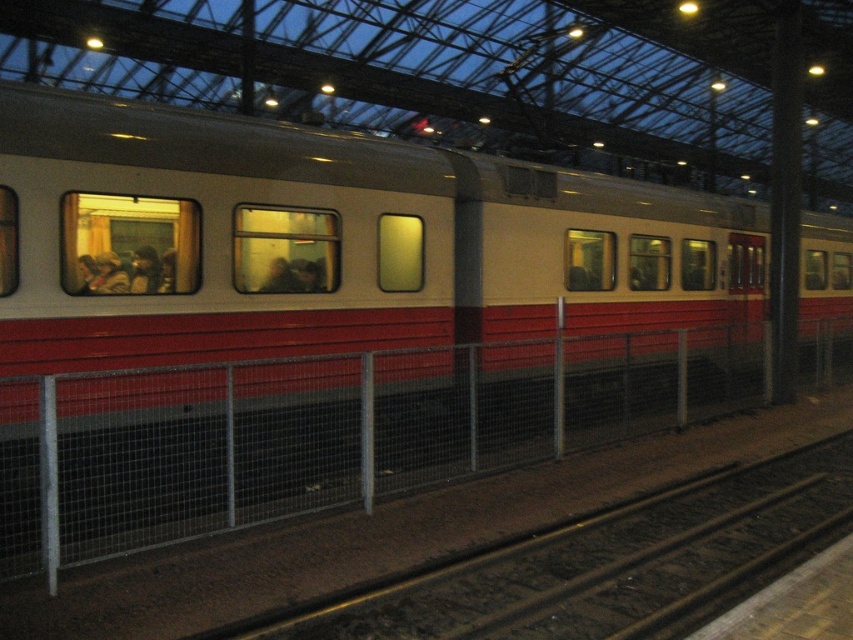
Question: Which point is closer to the camera?

Choices:
 (A) (288, 260)
 (B) (108, 269)
 (C) (148, 284)

Answer: (B)

Question: Which object is closer to the camera taking this photo?

Choices:
 (A) smooth glass window at center
 (B) smooth metal train track at lower center
 (C) smooth beige coat at left

Answer: (B)

Question: Is smooth beige coat at left wider than smooth beige coat at center?

Choices:
 (A) no
 (B) yes

Answer: (B)

Question: Does metal at center appear on the left side of smooth beige coat at center?

Choices:
 (A) no
 (B) yes

Answer: (A)

Question: Which object is farther from the camera taking this photo?

Choices:
 (A) smooth metal train track at lower center
 (B) smooth glass window at center

Answer: (B)

Question: Does smooth beige coat at left appear under smooth beige coat at center?

Choices:
 (A) no
 (B) yes

Answer: (B)